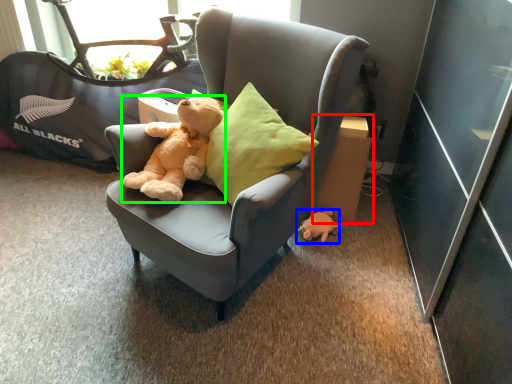
Question: Which object is the closest to the cardboard box (highlighted by a red box)? Choose among these: toy (highlighted by a blue box) or teddy bear (highlighted by a green box).

Choices:
 (A) toy
 (B) teddy bear

Answer: (A)